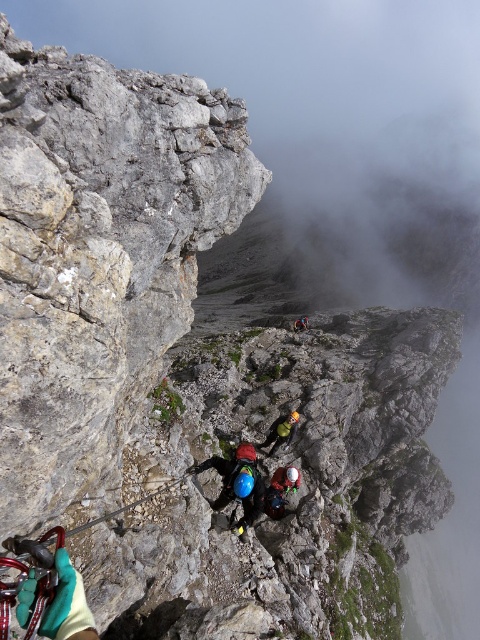
Is matte blue helmet at center positioned behind green fabric helmet at center?

No, it is in front of green fabric helmet at center.

The image size is (480, 640). I want to click on matte blue helmet at center, so click(279, 490).

Is point (282, 508) positioned in front of point (277, 442)?

Yes, it is in front of point (277, 442).

Locate an element on the screen. The width and height of the screenshot is (480, 640). matte blue helmet at center is located at coordinates (279, 490).

Can you confirm if green fabric helmet at center is positioned to the left of red helmet at center?

Correct, you'll find green fabric helmet at center to the left of red helmet at center.

Based on the photo, which is more to the left, green fabric helmet at center or red helmet at center?

green fabric helmet at center is more to the left.

Is point (290, 433) more distant than point (296, 320)?

No, it is in front of (296, 320).

The height and width of the screenshot is (640, 480). I want to click on green fabric helmet at center, so click(280, 432).

Can you confirm if matte blue helmet at center is thinner than red helmet at center?

Indeed, matte blue helmet at center has a lesser width compared to red helmet at center.

Which is behind, point (273, 477) or point (307, 321)?

The point (307, 321) is more distant.

Which is behind, point (280, 500) or point (296, 326)?

Point (296, 326)

Identify the location of matte blue helmet at center. Image resolution: width=480 pixels, height=640 pixels. (279, 490).